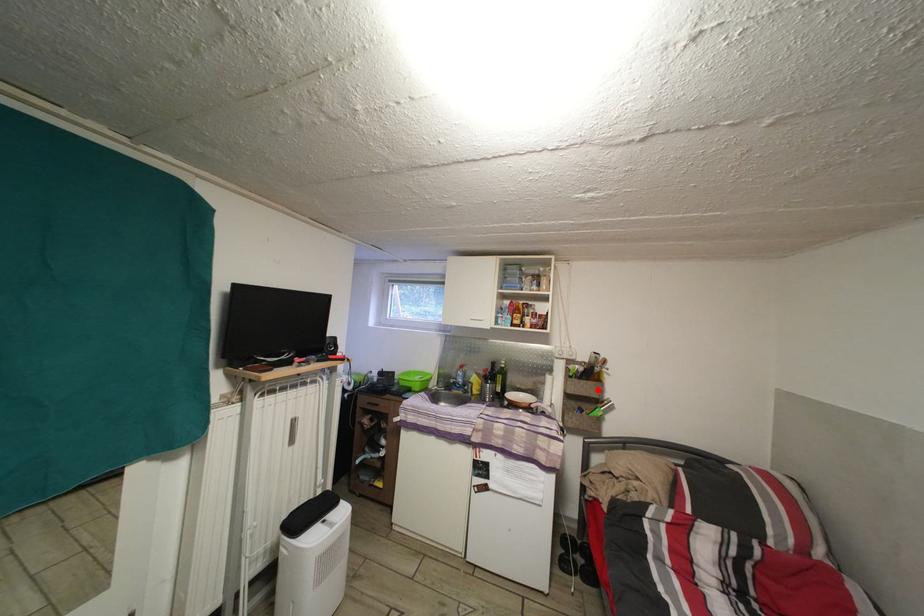
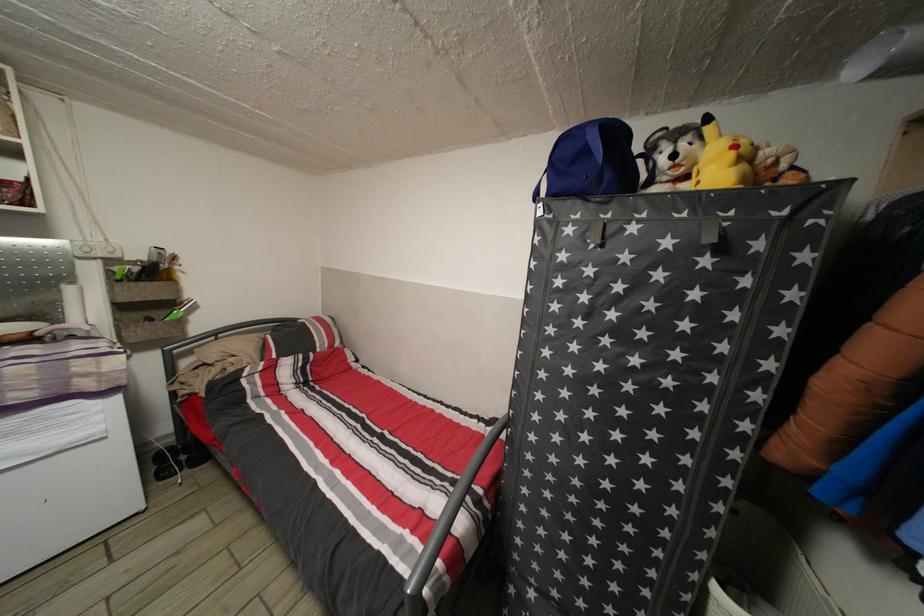
Where in the second image is the point corresponding to the highlighted location from the first image?

(164, 291)